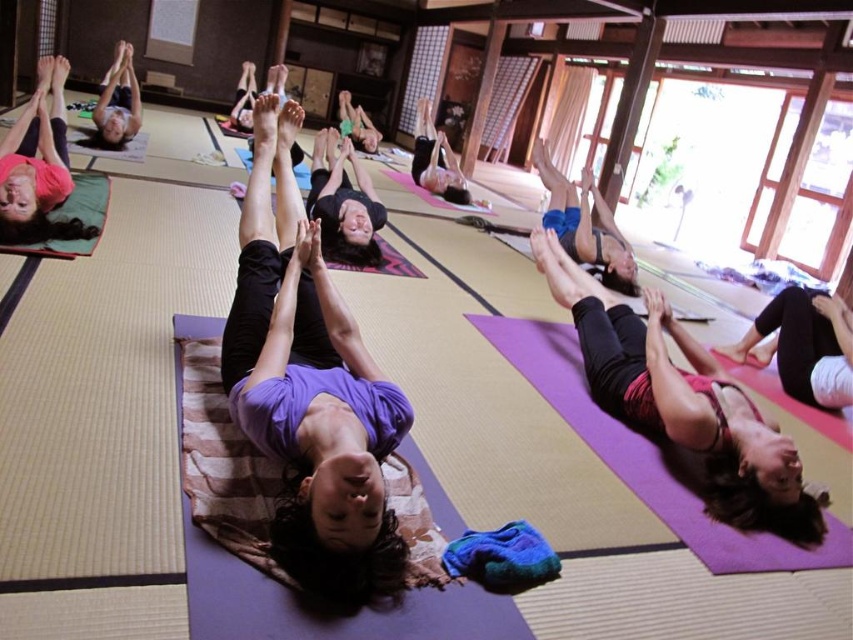
Question: Observing the image, what is the correct spatial positioning of matte green yoga mat at lower left in reference to black matte yoga mat at center?

Choices:
 (A) left
 (B) right

Answer: (A)

Question: Considering the real-world distances, which object is farthest from the matte black yoga mat at upper left?

Choices:
 (A) purple matte yoga mat at center
 (B) matte black yoga mat at center
 (C) pink fabric yoga mat at lower right
 (D) blue fabric at center

Answer: (C)

Question: Is black matte yoga mat at lower right further to camera compared to black matte yoga mat at center?

Choices:
 (A) yes
 (B) no

Answer: (B)

Question: From the image, what is the correct spatial relationship of pink fabric yoga mat at lower right in relation to matte green yoga mat at lower left?

Choices:
 (A) right
 (B) left

Answer: (A)

Question: Which of the following is the closest to the observer?

Choices:
 (A) (633, 260)
 (B) (740, 422)
 (C) (462, 184)

Answer: (B)

Question: Which object is the closest to the pink fabric yoga mat at lower right?

Choices:
 (A) matte black yoga mat at center
 (B) matte green yoga mat at lower left

Answer: (B)